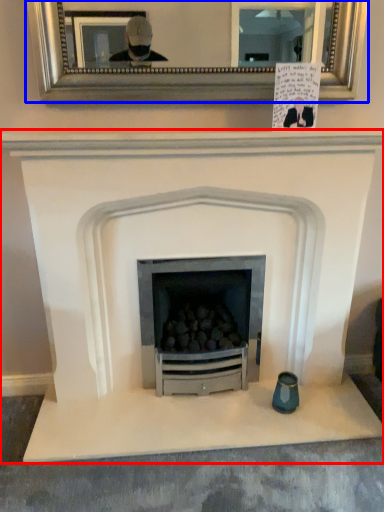
Question: Among these objects, which one is nearest to the camera, fireplace (highlighted by a red box) or picture frame (highlighted by a blue box)?

Choices:
 (A) fireplace
 (B) picture frame

Answer: (A)